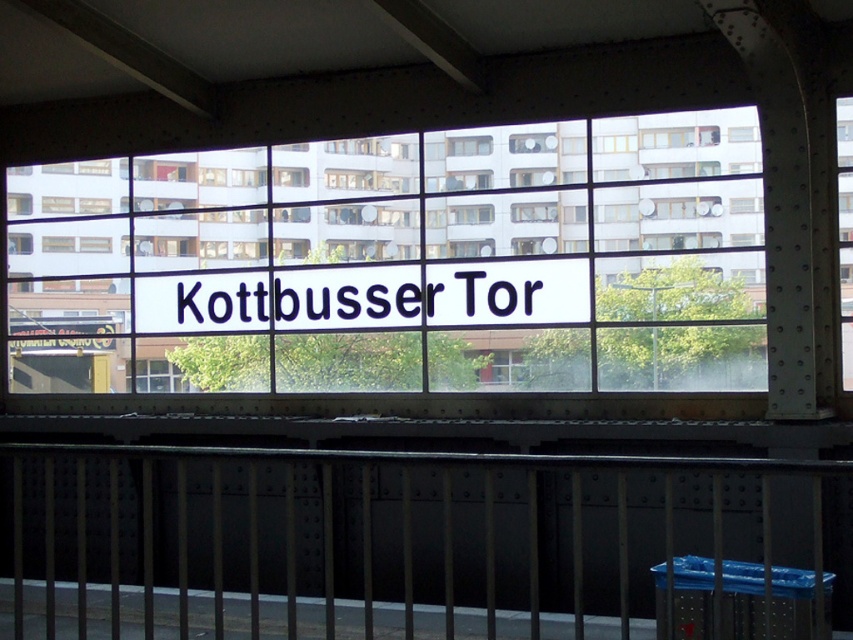
You are a maintenance worker needing to reach the transparent glass sign at center from the black metal rail at center. The ladder you have can extend up to 4 meters. Do you think you can reach the sign using the ladder?

The distance between the transparent glass sign at center and the black metal rail at center is 4.68 meters. Since the ladder can only extend up to 4 meters, it is not long enough to reach the sign. You will need a longer ladder or additional equipment.

You are a window cleaner standing at the center of the scene. You need to clean both the transparent glass sign at center and the black metal rail at center. Which object will require you to clean a larger area?

The black metal rail at center requires cleaning a larger area because the transparent glass sign at center occupies less space than it.

You are standing in front of the large window at the train station and see two points marked on the glass. The first point is at coordinate (230, 198) and the second is at (299, 547). Which point is closer to you?

Point (299, 547) is closer to you because it is in front of point (230, 198) according to their spatial relationship.